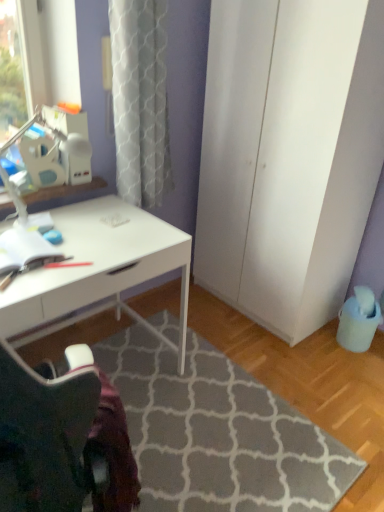
Locate an element on the screen. This screenshot has height=512, width=384. white matte cabinet at right is located at coordinates (288, 155).

Locate an element on the screen. This screenshot has height=512, width=384. gray textured rug at lower center is located at coordinates (219, 434).

Can you confirm if white matte cabinet at right is shorter than white glossy desk at center?

In fact, white matte cabinet at right may be taller than white glossy desk at center.

Between white matte cabinet at right and white glossy desk at center, which one appears on the right side from the viewer's perspective?

Positioned to the right is white matte cabinet at right.

The height and width of the screenshot is (512, 384). What are the coordinates of `screen door behind the white glossy desk at center` in the screenshot? It's located at (288, 155).

From the image's perspective, between white matte cabinet at right and white glossy desk at center, who is located below?

white glossy desk at center appears lower in the image.

How many degrees apart are the facing directions of gray textured rug at lower center and white matte cabinet at right?

They differ by 89.9 degrees in their facing directions.

From a real-world perspective, is gray textured rug at lower center beneath white matte cabinet at right?

Yes, from a real-world perspective, gray textured rug at lower center is under white matte cabinet at right.

Is gray textured rug at lower center facing away from white matte cabinet at right?

No, white matte cabinet at right is not at the back of gray textured rug at lower center.

Which object is further away from the camera, gray textured rug at lower center or white matte cabinet at right?

white matte cabinet at right is more distant.

Does point (268, 143) lie in front of point (143, 446)?

No.

Is white matte cabinet at right located outside gray textured rug at lower center?

Indeed, white matte cabinet at right is completely outside gray textured rug at lower center.

From the image's perspective, is white matte cabinet at right located above or below gray textured rug at lower center?

Based on their image positions, white matte cabinet at right is located above gray textured rug at lower center.

Which object is closer to the camera, gray textured rug at lower center or white glossy desk at center?

gray textured rug at lower center is closer to the camera.

Is gray textured rug at lower center facing away from white glossy desk at center?

No, white glossy desk at center is not at the back of gray textured rug at lower center.

From a real-world perspective, is gray textured rug at lower center positioned above or below white glossy desk at center?

In terms of real-world spatial position, gray textured rug at lower center is below white glossy desk at center.

From a real-world perspective, relative to gray textured rug at lower center, is white glossy desk at center vertically above or below?

In terms of real-world spatial position, white glossy desk at center is above gray textured rug at lower center.

Between white glossy desk at center and gray textured rug at lower center, which one has larger width?

With larger width is gray textured rug at lower center.

Which object is positioned more to the left, white glossy desk at center or gray textured rug at lower center?

From the viewer's perspective, white glossy desk at center appears more on the left side.

Would you say white glossy desk at center is inside or outside white matte cabinet at right?

white glossy desk at center is not inside white matte cabinet at right, it's outside.

Can you confirm if white glossy desk at center is thinner than white matte cabinet at right?

Incorrect, the width of white glossy desk at center is not less than that of white matte cabinet at right.

Where is `desk in front of the white matte cabinet at right`? desk in front of the white matte cabinet at right is located at coordinates coord(97,271).

At what (x,y) coordinates should I click in order to perform the action: click on screen door lying above the gray textured rug at lower center (from the image's perspective). Please return your answer as a coordinate pair (x, y). The height and width of the screenshot is (512, 384). Looking at the image, I should click on (288, 155).

Based on the photo, looking at the image, which one is located further to white matte cabinet at right, white glossy desk at center or gray textured rug at lower center?

gray textured rug at lower center.

Looking at the image, which one is located further to gray textured rug at lower center, white matte cabinet at right or white glossy desk at center?

Based on the image, white matte cabinet at right appears to be further to gray textured rug at lower center.

Based on their spatial positions, is gray textured rug at lower center or white matte cabinet at right further from white glossy desk at center?

white matte cabinet at right.

Considering their positions, is white matte cabinet at right positioned further to white glossy desk at center than gray textured rug at lower center?

white matte cabinet at right lies further to white glossy desk at center than the other object.

Looking at the image, which one is located further to gray textured rug at lower center, white glossy desk at center or white matte cabinet at right?

white matte cabinet at right.

From the image, which object appears to be nearer to white matte cabinet at right, gray textured rug at lower center or white glossy desk at center?

white glossy desk at center is positioned closer to the anchor white matte cabinet at right.

Identify the location of desk between white matte cabinet at right and gray textured rug at lower center from top to bottom. This screenshot has height=512, width=384. (97, 271).